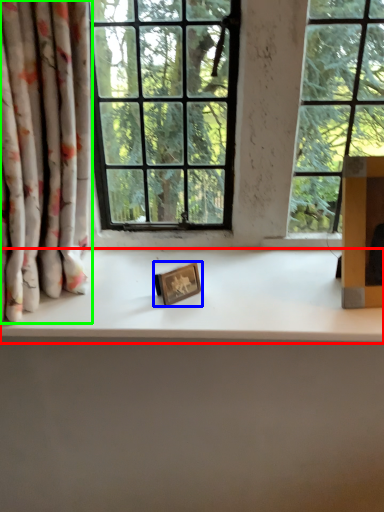
Question: Considering the real-world distances, which object is closest to counter top (highlighted by a red box)? picture frame (highlighted by a blue box) or curtain (highlighted by a green box).

Choices:
 (A) picture frame
 (B) curtain

Answer: (A)